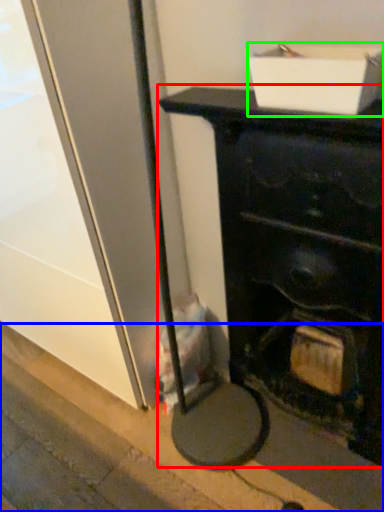
Question: Which object is the closest to the furniture (highlighted by a red box)? Choose among these: pavement (highlighted by a blue box) or cardboard box (highlighted by a green box).

Choices:
 (A) pavement
 (B) cardboard box

Answer: (B)